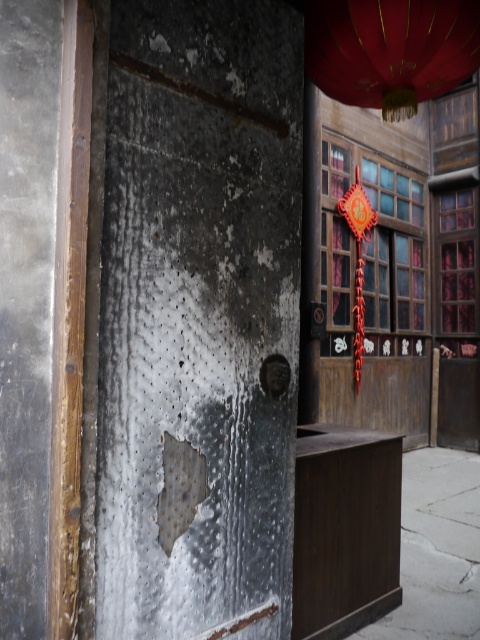
Who is taller, rusty metal door at center or shiny red paper lantern at upper center?

rusty metal door at center

Who is lower down, rusty metal door at center or shiny red paper lantern at upper center?

rusty metal door at center is lower down.

Does point (193, 506) lie in front of point (385, 22)?

Yes, it is in front of point (385, 22).

What are the coordinates of `rusty metal door at center` in the screenshot? It's located at (199, 317).